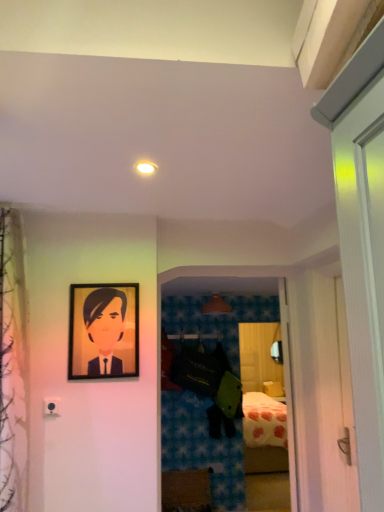
Locate an element on the screen. matte black portrait at upper left is located at coordinates (105, 328).

Where is `matte white light fixture at upper center`? The width and height of the screenshot is (384, 512). matte white light fixture at upper center is located at coordinates (146, 167).

Describe the element at coordinates (186, 490) in the screenshot. I see `wooden chest of drawers at lower center` at that location.

The width and height of the screenshot is (384, 512). Find the location of `wooden chest of drawers at lower center`. wooden chest of drawers at lower center is located at coordinates (186, 490).

The image size is (384, 512). I want to click on matte black portrait at upper left, so click(105, 328).

Is matte brown lampshade at center aimed at wooden chest of drawers at lower center?

No, matte brown lampshade at center is not facing towards wooden chest of drawers at lower center.

Consider the image. Is the surface of matte brown lampshade at center in direct contact with wooden chest of drawers at lower center?

matte brown lampshade at center and wooden chest of drawers at lower center are clearly separated.

Is matte brown lampshade at center to the right of wooden chest of drawers at lower center from the viewer's perspective?

Yes.

From the image's perspective, would you say matte brown lampshade at center is shown under wooden chest of drawers at lower center?

Actually, matte brown lampshade at center appears above wooden chest of drawers at lower center in the image.

What's the angular difference between matte brown lampshade at center and matte white light fixture at upper center's facing directions?

10.2 degrees separate the facing orientations of matte brown lampshade at center and matte white light fixture at upper center.

Which is in front, matte brown lampshade at center or matte white light fixture at upper center?

Positioned in front is matte white light fixture at upper center.

Looking at this image, which of these two, matte brown lampshade at center or matte white light fixture at upper center, stands shorter?

With less height is matte white light fixture at upper center.

From a real-world perspective, is matte brown lampshade at center on top of matte white light fixture at upper center?

No, from a real-world perspective, matte brown lampshade at center is not on top of matte white light fixture at upper center.

From a real-world perspective, between wooden chest of drawers at lower center and matte white light fixture at upper center, who is vertically lower?

wooden chest of drawers at lower center, from a real-world perspective.

Between wooden chest of drawers at lower center and matte white light fixture at upper center, which one has less height?

With less height is matte white light fixture at upper center.

Find the location of a particular element. This screenshot has height=512, width=384. lighting to the left of wooden chest of drawers at lower center is located at coordinates (146, 167).

Considering the positions of objects wooden chest of drawers at lower center and matte white light fixture at upper center in the image provided, who is more to the left, wooden chest of drawers at lower center or matte white light fixture at upper center?

From the viewer's perspective, matte white light fixture at upper center appears more on the left side.

Which is in front, point (150, 172) or point (212, 295)?

Positioned in front is point (150, 172).

Is matte white light fixture at upper center bigger or smaller than matte brown lampshade at center?

In the image, matte white light fixture at upper center appears to be smaller than matte brown lampshade at center.

Is matte white light fixture at upper center positioned beyond the bounds of matte brown lampshade at center?

That's correct, matte white light fixture at upper center is outside of matte brown lampshade at center.

Considering the relative positions of matte white light fixture at upper center and matte brown lampshade at center in the image provided, is matte white light fixture at upper center to the right of matte brown lampshade at center from the viewer's perspective?

Incorrect, matte white light fixture at upper center is not on the right side of matte brown lampshade at center.

Which of these two, wooden chest of drawers at lower center or matte brown lampshade at center, stands taller?

Standing taller between the two is wooden chest of drawers at lower center.

Is wooden chest of drawers at lower center aimed at matte brown lampshade at center?

No, wooden chest of drawers at lower center is not oriented towards matte brown lampshade at center.

Can you confirm if wooden chest of drawers at lower center is wider than matte brown lampshade at center?

Indeed, wooden chest of drawers at lower center has a greater width compared to matte brown lampshade at center.

Which object is positioned more to the left, wooden chest of drawers at lower center or matte brown lampshade at center?

wooden chest of drawers at lower center.

How far apart are matte white light fixture at upper center and wooden chest of drawers at lower center?

They are 3.28 meters apart.

From a real-world perspective, which is physically below, matte white light fixture at upper center or wooden chest of drawers at lower center?

In real-world perspective, wooden chest of drawers at lower center is lower.

Is matte white light fixture at upper center to the left of wooden chest of drawers at lower center from the viewer's perspective?

Indeed, matte white light fixture at upper center is positioned on the left side of wooden chest of drawers at lower center.

In the scene shown: Is matte white light fixture at upper center in front of or behind wooden chest of drawers at lower center in the image?

Visually, matte white light fixture at upper center is located in front of wooden chest of drawers at lower center.

Are matte black portrait at upper left and matte white light fixture at upper center beside each other?

No, matte black portrait at upper left is not in contact with matte white light fixture at upper center.

From a real-world perspective, is matte black portrait at upper left under matte white light fixture at upper center?

Yes.

How far apart are matte black portrait at upper left and matte white light fixture at upper center?

A distance of 32.12 inches exists between matte black portrait at upper left and matte white light fixture at upper center.

Which of these two, matte black portrait at upper left or matte white light fixture at upper center, is smaller?

With smaller size is matte white light fixture at upper center.

You are a GUI agent. You are given a task and a screenshot of the screen. Output one action in this format:
    pyautogui.click(x=<x>, y=<y>)
    Task: Click on the lamp behind the wooden chest of drawers at lower center
    The width and height of the screenshot is (384, 512).
    Given the screenshot: What is the action you would take?
    pyautogui.click(x=216, y=305)

Where is `lamp below the matte white light fixture at upper center (from a real-world perspective)`? lamp below the matte white light fixture at upper center (from a real-world perspective) is located at coordinates (216, 305).

Which object lies further to the anchor point matte black portrait at upper left, matte brown lampshade at center or matte white light fixture at upper center?

matte brown lampshade at center lies further to matte black portrait at upper left than the other object.

Estimate the real-world distances between objects in this image. Which object is closer to matte brown lampshade at center, matte black portrait at upper left or matte white light fixture at upper center?

The object closer to matte brown lampshade at center is matte black portrait at upper left.

Estimate the real-world distances between objects in this image. Which object is further from matte white light fixture at upper center, wooden chest of drawers at lower center or matte black portrait at upper left?

wooden chest of drawers at lower center is further to matte white light fixture at upper center.

Looking at the image, which one is located further to wooden chest of drawers at lower center, matte white light fixture at upper center or matte brown lampshade at center?

Among the two, matte white light fixture at upper center is located further to wooden chest of drawers at lower center.

Looking at this image, when comparing their distances from matte black portrait at upper left, does matte white light fixture at upper center or wooden chest of drawers at lower center seem closer?

matte white light fixture at upper center lies closer to matte black portrait at upper left than the other object.

Estimate the real-world distances between objects in this image. Which object is closer to wooden chest of drawers at lower center, matte brown lampshade at center or matte black portrait at upper left?

The object closer to wooden chest of drawers at lower center is matte brown lampshade at center.

Which object lies further to the anchor point wooden chest of drawers at lower center, matte brown lampshade at center or matte white light fixture at upper center?

Based on the image, matte white light fixture at upper center appears to be further to wooden chest of drawers at lower center.

Based on their spatial positions, is wooden chest of drawers at lower center or matte brown lampshade at center further from matte white light fixture at upper center?

wooden chest of drawers at lower center is further to matte white light fixture at upper center.

You are a GUI agent. You are given a task and a screenshot of the screen. Output one action in this format:
    pyautogui.click(x=<x>, y=<y>)
    Task: Click on the person positioned between matte white light fixture at upper center and matte brown lampshade at center from near to far
    
    Given the screenshot: What is the action you would take?
    pyautogui.click(x=105, y=328)

I want to click on lamp between matte white light fixture at upper center and wooden chest of drawers at lower center in the up-down direction, so click(216, 305).

Identify the location of lamp between matte black portrait at upper left and wooden chest of drawers at lower center from top to bottom. (216, 305).

Where is `person between matte white light fixture at upper center and wooden chest of drawers at lower center in the up-down direction`? person between matte white light fixture at upper center and wooden chest of drawers at lower center in the up-down direction is located at coordinates (105, 328).